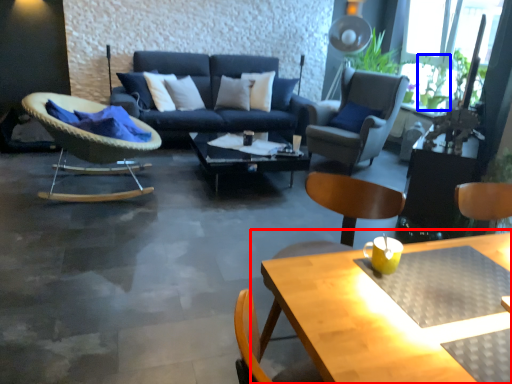
Question: Which object appears farthest to the camera in this image, table (highlighted by a red box) or plant (highlighted by a blue box)?

Choices:
 (A) table
 (B) plant

Answer: (B)